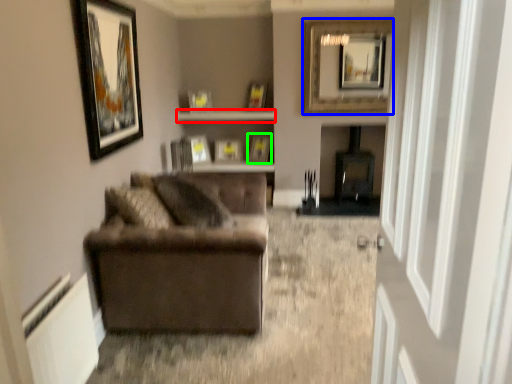
Question: Considering the real-world distances, which object is closest to shelf (highlighted by a red box)? picture frame (highlighted by a blue box) or picture frame (highlighted by a green box).

Choices:
 (A) picture frame
 (B) picture frame

Answer: (B)